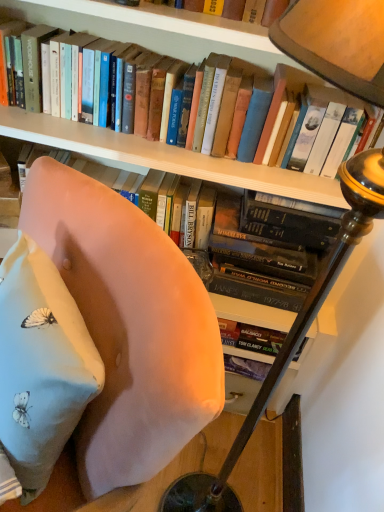
Where is `light pink fabric pillow at lower left`? The image size is (384, 512). light pink fabric pillow at lower left is located at coordinates (41, 364).

Image resolution: width=384 pixels, height=512 pixels. Find the location of `wooden table lamp at upper right`. wooden table lamp at upper right is located at coordinates (291, 332).

How different are the orientations of light pink fabric pillow at lower left and hardcover book at upper center in degrees?

49.7 degrees.

Looking at this image, considering the positions of objects light pink fabric pillow at lower left and hardcover book at upper center in the image provided, who is more to the right, light pink fabric pillow at lower left or hardcover book at upper center?

Positioned to the right is hardcover book at upper center.

From a real-world perspective, is light pink fabric pillow at lower left physically below hardcover book at upper center?

Yes, from a real-world perspective, light pink fabric pillow at lower left is under hardcover book at upper center.

Is light pink fabric pillow at lower left looking in the opposite direction of hardcover book at upper center?

light pink fabric pillow at lower left does not have its back to hardcover book at upper center.

Which of these two, hardcover book at upper center or pink fabric chair at center, stands taller?

pink fabric chair at center.

Which object is thinner, hardcover book at upper center or pink fabric chair at center?

With smaller width is hardcover book at upper center.

Does point (106, 31) lie in front of point (76, 181)?

No, (106, 31) is behind (76, 181).

How different are the orientations of hardcover book at upper center and pink fabric chair at center in degrees?

They differ by 51.1 degrees in their facing directions.

Consider the image. From a real-world perspective, is light pink fabric pillow at lower left below pink fabric chair at center?

No, from a real-world perspective, light pink fabric pillow at lower left is not beneath pink fabric chair at center.

Is pink fabric chair at center surrounded by light pink fabric pillow at lower left?

No, pink fabric chair at center is not inside light pink fabric pillow at lower left.

Considering the points (71, 372) and (127, 355), which point is behind, point (71, 372) or point (127, 355)?

Positioned behind is point (127, 355).

Is light pink fabric pillow at lower left positioned far away from pink fabric chair at center?

No.

From the picture: What's the angular difference between wooden table lamp at upper right and hardcover book at upper center's facing directions?

88.1 degrees separate the facing orientations of wooden table lamp at upper right and hardcover book at upper center.

Is wooden table lamp at upper right taller or shorter than hardcover book at upper center?

In the image, wooden table lamp at upper right appears to be taller than hardcover book at upper center.

From the picture: Is wooden table lamp at upper right oriented towards hardcover book at upper center?

No, wooden table lamp at upper right is not oriented towards hardcover book at upper center.

Looking at their sizes, would you say wooden table lamp at upper right is wider or thinner than hardcover book at upper center?

Clearly, wooden table lamp at upper right has more width compared to hardcover book at upper center.

Measure the distance from pink fabric chair at center to wooden table lamp at upper right.

The distance of pink fabric chair at center from wooden table lamp at upper right is 22.37 inches.

The image size is (384, 512). In the image, there is a wooden table lamp at upper right. Find the location of `chair below it (from the image's perspective)`. chair below it (from the image's perspective) is located at coordinates (129, 325).

Which object is positioned more to the left, pink fabric chair at center or wooden table lamp at upper right?

pink fabric chair at center.

From the image's perspective, which one is positioned higher, pink fabric chair at center or wooden table lamp at upper right?

wooden table lamp at upper right appears higher in the image.

Can you confirm if pink fabric chair at center is positioned to the left of hardcover book at upper center?

Indeed, pink fabric chair at center is positioned on the left side of hardcover book at upper center.

Which is less distant, [199,396] or [263,42]?

Point [199,396] is closer to the camera than point [263,42].

Which object is more forward, pink fabric chair at center or hardcover book at upper center?

pink fabric chair at center is in front.

Does pink fabric chair at center have a lesser width compared to hardcover book at upper center?

No, pink fabric chair at center is not thinner than hardcover book at upper center.

Looking at this image, which is correct: wooden table lamp at upper right is inside light pink fabric pillow at lower left, or outside of it?

wooden table lamp at upper right exists outside the volume of light pink fabric pillow at lower left.

Considering the sizes of wooden table lamp at upper right and light pink fabric pillow at lower left in the image, is wooden table lamp at upper right taller or shorter than light pink fabric pillow at lower left?

wooden table lamp at upper right is taller than light pink fabric pillow at lower left.

Is wooden table lamp at upper right not near light pink fabric pillow at lower left?

That's not correct — wooden table lamp at upper right is a little close to light pink fabric pillow at lower left.

Which is more to the right, wooden table lamp at upper right or light pink fabric pillow at lower left?

From the viewer's perspective, wooden table lamp at upper right appears more on the right side.

In the image, there is a light pink fabric pillow at lower left. At what (x,y) coordinates should I click in order to perform the action: click on book above it (from the image's perspective). Please return your answer as a coordinate pair (x, y). Looking at the image, I should click on (202, 45).

This screenshot has height=512, width=384. I want to click on book that is behind the pink fabric chair at center, so click(x=202, y=45).

Estimate the real-world distances between objects in this image. Which object is further from pink fabric chair at center, wooden table lamp at upper right or hardcover book at upper center?

hardcover book at upper center lies further to pink fabric chair at center than the other object.

Looking at the image, which one is located further to wooden table lamp at upper right, hardcover book at upper center or pink fabric chair at center?

hardcover book at upper center is further to wooden table lamp at upper right.

Estimate the real-world distances between objects in this image. Which object is closer to hardcover book at upper center, wooden table lamp at upper right or light pink fabric pillow at lower left?

wooden table lamp at upper right is closer to hardcover book at upper center.

Looking at the image, which one is located closer to pink fabric chair at center, wooden table lamp at upper right or light pink fabric pillow at lower left?

light pink fabric pillow at lower left is positioned closer to the anchor pink fabric chair at center.

When comparing their distances from light pink fabric pillow at lower left, does hardcover book at upper center or wooden table lamp at upper right seem closer?

The object closer to light pink fabric pillow at lower left is wooden table lamp at upper right.

Considering their positions, is wooden table lamp at upper right positioned further to hardcover book at upper center than pink fabric chair at center?

The object further to hardcover book at upper center is pink fabric chair at center.

Based on their spatial positions, is hardcover book at upper center or light pink fabric pillow at lower left closer to pink fabric chair at center?

light pink fabric pillow at lower left lies closer to pink fabric chair at center than the other object.

When comparing their distances from pink fabric chair at center, does light pink fabric pillow at lower left or hardcover book at upper center seem closer?

light pink fabric pillow at lower left is positioned closer to the anchor pink fabric chair at center.

Where is `pillow located between wooden table lamp at upper right and hardcover book at upper center in the depth direction`? The width and height of the screenshot is (384, 512). pillow located between wooden table lamp at upper right and hardcover book at upper center in the depth direction is located at coordinates (41, 364).

You are a GUI agent. You are given a task and a screenshot of the screen. Output one action in this format:
    pyautogui.click(x=<x>, y=<y>)
    Task: Click on the table lamp between hardcover book at upper center and pink fabric chair at center from top to bottom
    This screenshot has width=384, height=512.
    Given the screenshot: What is the action you would take?
    pyautogui.click(x=291, y=332)

You are a GUI agent. You are given a task and a screenshot of the screen. Output one action in this format:
    pyautogui.click(x=<x>, y=<y>)
    Task: Click on the pillow between hardcover book at upper center and pink fabric chair at center in the vertical direction
    This screenshot has height=512, width=384.
    Given the screenshot: What is the action you would take?
    pyautogui.click(x=41, y=364)

What are the coordinates of `chair located between light pink fabric pillow at lower left and wooden table lamp at upper right in the left-right direction` in the screenshot? It's located at (129, 325).